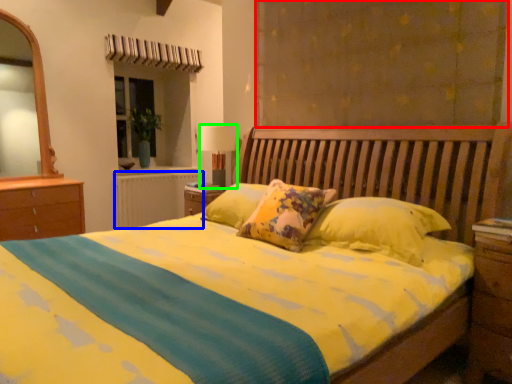
Question: Which is nearer to the curtain (highlighted by a red box)? radiator (highlighted by a blue box) or table lamp (highlighted by a green box).

Choices:
 (A) radiator
 (B) table lamp

Answer: (B)